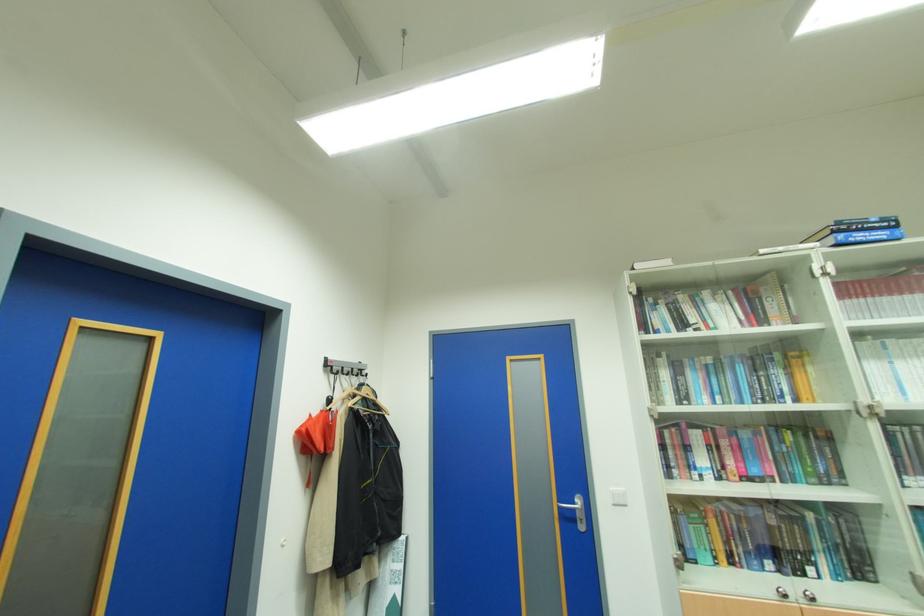
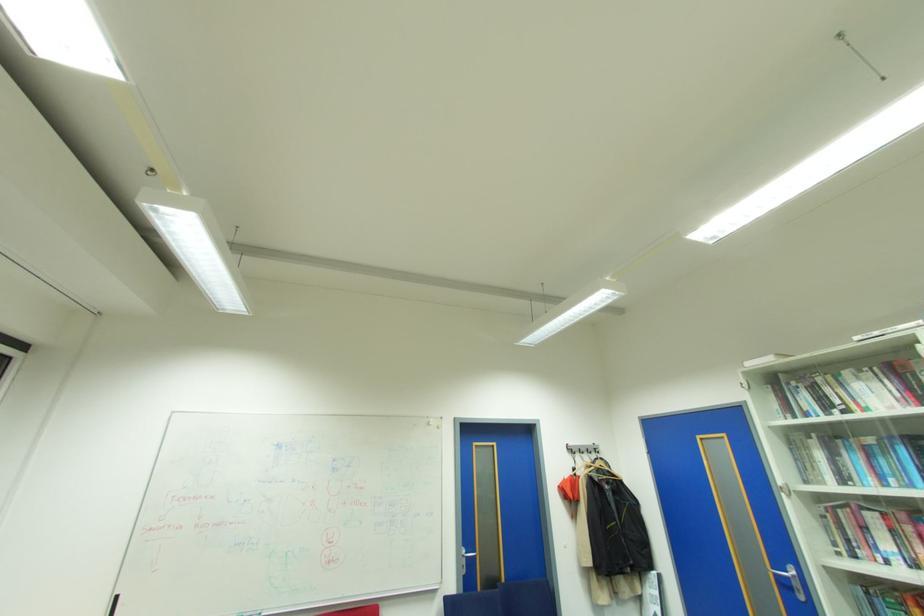
In the second image, find the point that corresponds to (578,509) in the first image.

(791, 578)